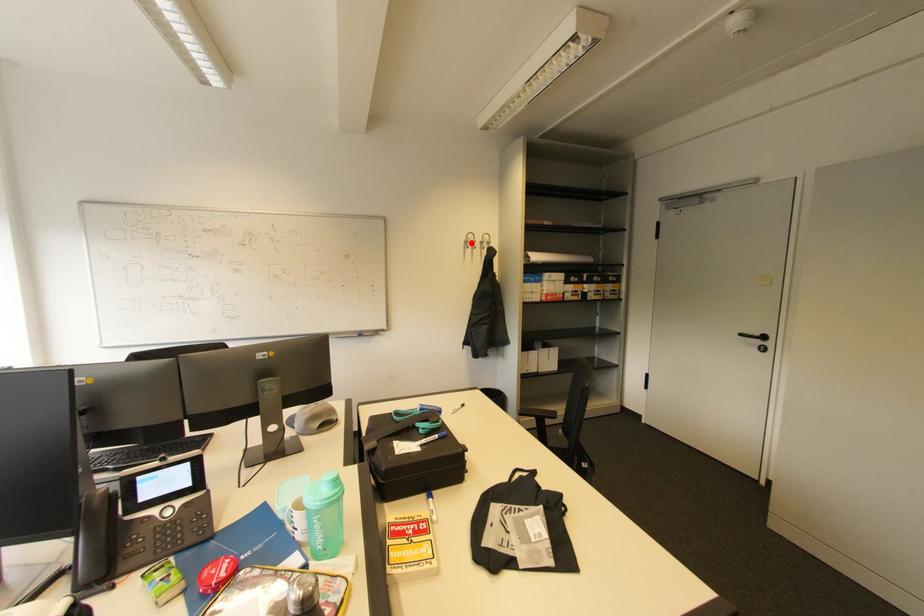
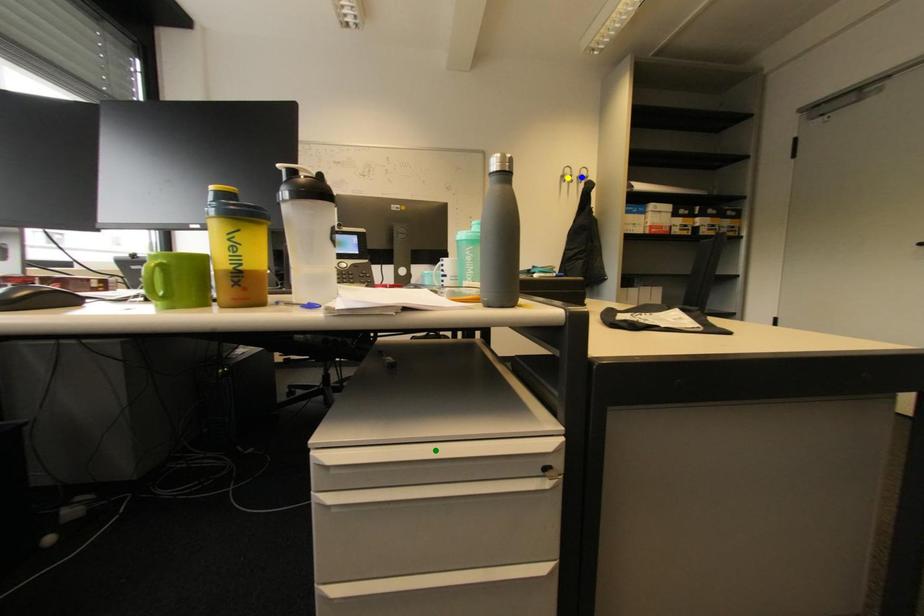
Question: I am providing you with two images of the same scene from different viewpoints. A red point is marked on the first image. You are given multiple points on the second image. Which mark in image 2 goes with the point in image 1?

Choices:
 (A) yellow point
 (B) blue point
 (C) green point

Answer: (A)